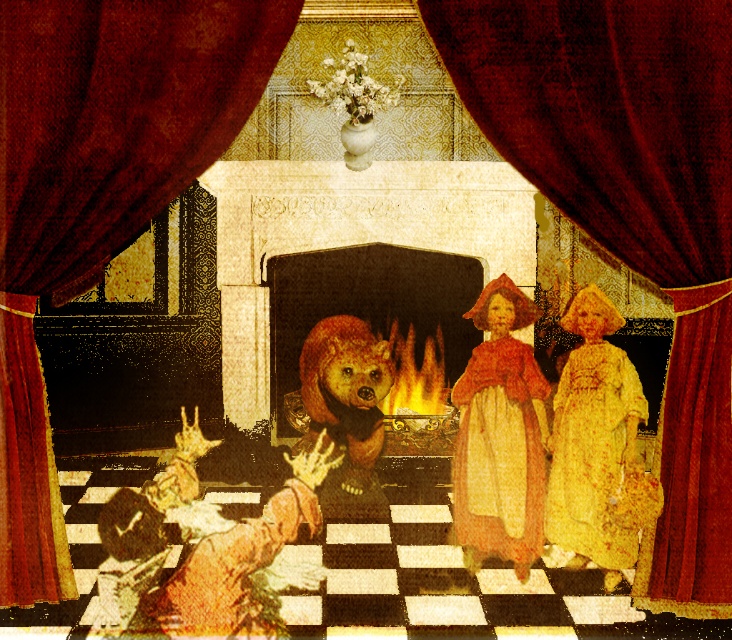
Can you confirm if smooth stone fireplace at center is positioned to the left of yellow floral fabric dress at center?

Indeed, smooth stone fireplace at center is positioned on the left side of yellow floral fabric dress at center.

Between point (384, 268) and point (600, 564), which one is positioned behind?

The point (384, 268) is behind.

Who is more forward, [318,308] or [580,499]?

Point [580,499] is in front.

At what (x,y) coordinates should I click in order to perform the action: click on smooth stone fireplace at center. Please return your answer as a coordinate pair (x, y). Image resolution: width=732 pixels, height=640 pixels. Looking at the image, I should click on tap(369, 301).

Who is positioned more to the right, marble fireplace at center or yellow floral fabric dress at center?

yellow floral fabric dress at center is more to the right.

Which is behind, point (228, 170) or point (583, 426)?

The point (228, 170) is more distant.

This screenshot has width=732, height=640. Find the location of `marble fireplace at center`. marble fireplace at center is located at coordinates (348, 236).

Is velvet curtain at right above velvet yellow dress at center?

Indeed, velvet curtain at right is positioned over velvet yellow dress at center.

Who is positioned more to the left, velvet curtain at right or velvet yellow dress at center?

velvet yellow dress at center is more to the left.

Locate an element on the screen. The image size is (732, 640). velvet curtain at right is located at coordinates (631, 211).

This screenshot has height=640, width=732. I want to click on velvet curtain at right, so click(x=631, y=211).